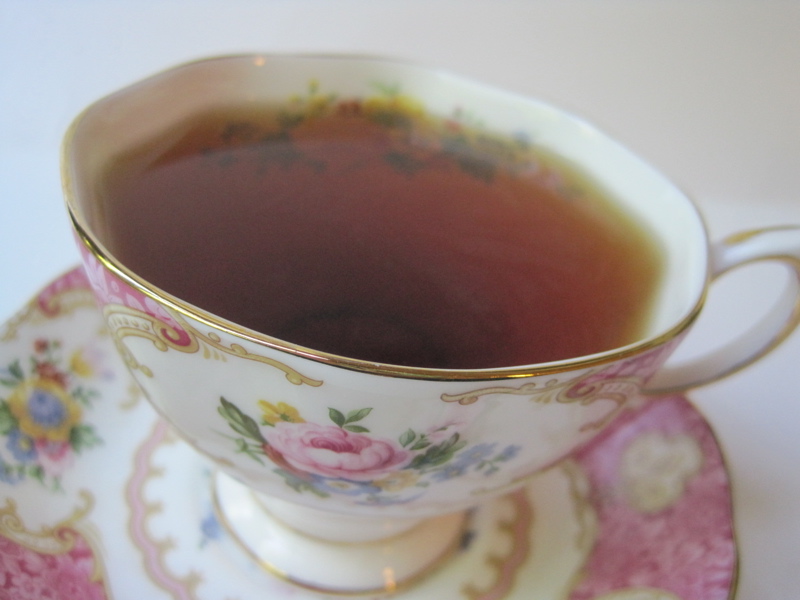
The image size is (800, 600). I want to click on cup handle, so pyautogui.click(x=753, y=242).